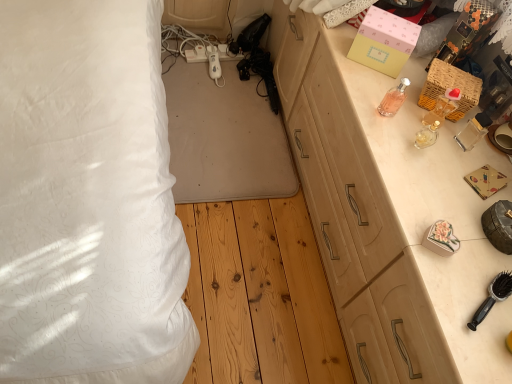
What do you see at coordinates (389, 215) in the screenshot?
I see `light wood cabinet at right` at bounding box center [389, 215].

This screenshot has height=384, width=512. In order to click on pink glass bottle at upper right, the first perfume in the left-to-right sequence in this screenshot , I will do `click(393, 99)`.

Measure the distance between woven wicker basket at upper right, the first box from the right, and camera.

woven wicker basket at upper right, the first box from the right, and camera are 3.87 feet apart.

What do you see at coordinates (426, 135) in the screenshot? I see `translucent glass perfume at right, the second perfume from the left` at bounding box center [426, 135].

Where is `light wood cabinet at right`? Image resolution: width=512 pixels, height=384 pixels. light wood cabinet at right is located at coordinates (389, 215).

From the image's perspective, is woven wicker basket at upper right, the first box from the right, above or below translucent glass perfume at right, the second perfume from the left?

woven wicker basket at upper right, the first box from the right, is above translucent glass perfume at right, the second perfume from the left.

Which is in front, point (434, 97) or point (422, 133)?

The point (434, 97) is more forward.

Which is more to the right, woven wicker basket at upper right, the first box from the right, or translucent glass perfume at right, the 2th perfume viewed from the right?

From the viewer's perspective, woven wicker basket at upper right, the first box from the right, appears more on the right side.

Does woven wicker basket at upper right, the first box from the right, have a lesser width compared to translucent glass perfume at right, the 2th perfume viewed from the right?

No, woven wicker basket at upper right, the first box from the right, is not thinner than translucent glass perfume at right, the 2th perfume viewed from the right.

Which of these two, black plastic brush at lower right or woven wicker basket at upper right, the first box from the right, stands taller?

woven wicker basket at upper right, the first box from the right, is taller.

Do you think black plastic brush at lower right is within woven wicker basket at upper right, which is the second box from left to right, or outside of it?

black plastic brush at lower right is not enclosed by woven wicker basket at upper right, which is the second box from left to right.

Does light wood cabinet at right lie in front of pink glass bottle at upper right, the first perfume in the left-to-right sequence?

Yes, it is.

Does light wood cabinet at right turn towards pink glass bottle at upper right, the first perfume in the left-to-right sequence?

No, light wood cabinet at right does not turn towards pink glass bottle at upper right, the first perfume in the left-to-right sequence.

How far apart are light wood cabinet at right and pink glass bottle at upper right, the first perfume in the left-to-right sequence?

light wood cabinet at right is 32.10 centimeters away from pink glass bottle at upper right, the first perfume in the left-to-right sequence.

Is light wood cabinet at right touching pink glass bottle at upper right, the first perfume in the left-to-right sequence?

They are not placed beside each other.

Is there a large distance between clear glass perfume at upper right, marked as the 3th perfume in a left-to-right arrangement, and light wood cabinet at right?

Actually, clear glass perfume at upper right, marked as the 3th perfume in a left-to-right arrangement, and light wood cabinet at right are a little close together.

Based on the photo, from the image's perspective, is clear glass perfume at upper right, marked as the 3th perfume in a left-to-right arrangement, on top of light wood cabinet at right?

Indeed, from the image's perspective, clear glass perfume at upper right, marked as the 3th perfume in a left-to-right arrangement, is shown above light wood cabinet at right.

Does clear glass perfume at upper right, marked as the 3th perfume in a left-to-right arrangement, have a lesser height compared to light wood cabinet at right?

Correct, clear glass perfume at upper right, marked as the 3th perfume in a left-to-right arrangement, is not as tall as light wood cabinet at right.

From a real-world perspective, which is physically below, clear glass perfume at upper right, marked as the 3th perfume in a left-to-right arrangement, or light wood cabinet at right?

In real-world perspective, light wood cabinet at right is lower.

Looking at the image, does black plastic brush at lower right seem bigger or smaller compared to light wood cabinet at right?

Considering their sizes, black plastic brush at lower right takes up less space than light wood cabinet at right.

Looking at this image, is light wood cabinet at right inside black plastic brush at lower right?

No, light wood cabinet at right is located outside of black plastic brush at lower right.

Is black plastic brush at lower right aimed at light wood cabinet at right?

No, black plastic brush at lower right is not facing towards light wood cabinet at right.

Is pink glass bottle at upper right, the first perfume in the left-to-right sequence, in front of or behind black plastic brush at lower right in the image?

pink glass bottle at upper right, the first perfume in the left-to-right sequence, is positioned farther from the viewer than black plastic brush at lower right.

Between pink glass bottle at upper right, the first perfume in the left-to-right sequence, and black plastic brush at lower right, which one has more height?

Standing taller between the two is pink glass bottle at upper right, the first perfume in the left-to-right sequence.

Is black plastic brush at lower right a part of pink glass bottle at upper right, the first perfume in the left-to-right sequence?

That's incorrect, black plastic brush at lower right is not inside pink glass bottle at upper right, the first perfume in the left-to-right sequence.

Is light wood cabinet at right bigger or smaller than clear glass perfume at upper right, the 1th perfume viewed from the right?

Clearly, light wood cabinet at right is larger in size than clear glass perfume at upper right, the 1th perfume viewed from the right.

Would you consider light wood cabinet at right to be distant from clear glass perfume at upper right, the 1th perfume viewed from the right?

No, light wood cabinet at right is not far from clear glass perfume at upper right, the 1th perfume viewed from the right.

Is light wood cabinet at right aimed at clear glass perfume at upper right, marked as the 3th perfume in a left-to-right arrangement?

No, light wood cabinet at right does not turn towards clear glass perfume at upper right, marked as the 3th perfume in a left-to-right arrangement.

Is point (417, 110) positioned before point (454, 110)?

Yes, it is in front of point (454, 110).

Where is `box on the right of translucent glass perfume at right, the second perfume from the left`? The image size is (512, 384). box on the right of translucent glass perfume at right, the second perfume from the left is located at coordinates (450, 87).

Locate an element on the screen. The image size is (512, 384). brush beneath the woven wicker basket at upper right, which is the second box from left to right (from a real-world perspective) is located at coordinates (493, 297).

Which object lies further to the anchor point translucent glass perfume at right, the 2th perfume viewed from the right, black plastic brush at lower right or woven wicker basket at upper right, which is the second box from left to right?

black plastic brush at lower right is further to translucent glass perfume at right, the 2th perfume viewed from the right.

Estimate the real-world distances between objects in this image. Which object is further from woven wicker basket at upper right, which is the second box from left to right, translucent glass perfume at right, the 2th perfume viewed from the right, or pink matte box at upper right, placed as the first box when sorted from left to right?

Based on the image, pink matte box at upper right, placed as the first box when sorted from left to right, appears to be further to woven wicker basket at upper right, which is the second box from left to right.

Estimate the real-world distances between objects in this image. Which object is closer to pink matte box at upper right, arranged as the 2th box when viewed from the right, clear glass perfume at upper right, marked as the 3th perfume in a left-to-right arrangement, or black plastic brush at lower right?

clear glass perfume at upper right, marked as the 3th perfume in a left-to-right arrangement, lies closer to pink matte box at upper right, arranged as the 2th box when viewed from the right, than the other object.

Considering their positions, is light wood cabinet at right positioned further to translucent glass perfume at right, the second perfume from the left, than woven wicker basket at upper right, the first box from the right?

light wood cabinet at right is further to translucent glass perfume at right, the second perfume from the left.

Looking at the image, which one is located closer to clear glass perfume at upper right, the 1th perfume viewed from the right, pink glass bottle at upper right, positioned as the 3th perfume in right-to-left order, or woven wicker basket at upper right, which is the second box from left to right?

woven wicker basket at upper right, which is the second box from left to right, lies closer to clear glass perfume at upper right, the 1th perfume viewed from the right, than the other object.

Which object lies further to the anchor point pink glass bottle at upper right, the first perfume in the left-to-right sequence, light wood cabinet at right or woven wicker basket at upper right, which is the second box from left to right?

The object further to pink glass bottle at upper right, the first perfume in the left-to-right sequence, is light wood cabinet at right.

Considering their positions, is clear glass perfume at upper right, marked as the 3th perfume in a left-to-right arrangement, positioned further to translucent glass perfume at right, the second perfume from the left, than pink glass bottle at upper right, the first perfume in the left-to-right sequence?

Among the two, pink glass bottle at upper right, the first perfume in the left-to-right sequence, is located further to translucent glass perfume at right, the second perfume from the left.

When comparing their distances from pink matte box at upper right, placed as the first box when sorted from left to right, does pink glass bottle at upper right, the first perfume in the left-to-right sequence, or translucent glass perfume at right, the 2th perfume viewed from the right, seem closer?

The object closer to pink matte box at upper right, placed as the first box when sorted from left to right, is pink glass bottle at upper right, the first perfume in the left-to-right sequence.

You are a GUI agent. You are given a task and a screenshot of the screen. Output one action in this format:
    pyautogui.click(x=<x>, y=<y>)
    Task: Click on the perfume between pink glass bottle at upper right, positioned as the 3th perfume in right-to-left order, and clear glass perfume at upper right, the 1th perfume viewed from the right, in the horizontal direction
    
    Given the screenshot: What is the action you would take?
    pyautogui.click(x=426, y=135)

Identify the location of cabinetry between translucent glass perfume at right, the 2th perfume viewed from the right, and black plastic brush at lower right, in the vertical direction. The height and width of the screenshot is (384, 512). (389, 215).

The width and height of the screenshot is (512, 384). In order to click on perfume between light wood cabinet at right and clear glass perfume at upper right, marked as the 3th perfume in a left-to-right arrangement, in the front-back direction in this screenshot , I will do `click(426, 135)`.

Locate an element on the screen. The width and height of the screenshot is (512, 384). perfume that lies between clear glass perfume at upper right, the 1th perfume viewed from the right, and black plastic brush at lower right from top to bottom is located at coordinates (426, 135).